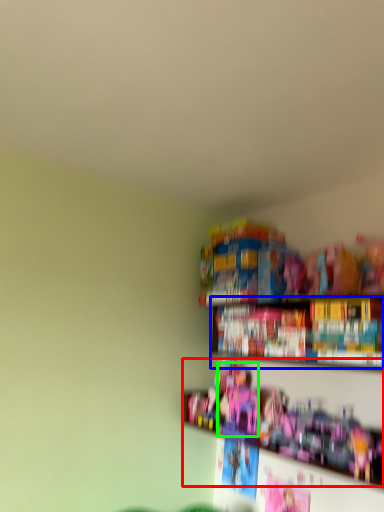
Question: Considering the real-world distances, which object is closest to toy (highlighted by a red box)? book (highlighted by a blue box) or toy (highlighted by a green box).

Choices:
 (A) book
 (B) toy

Answer: (B)